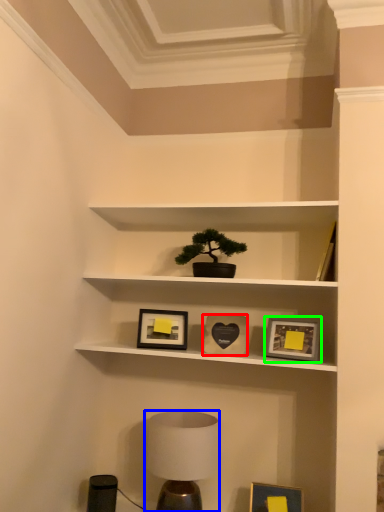
Question: Estimate the real-world distances between objects in this image. Which object is farther from picture frame (highlighted by a red box), table lamp (highlighted by a blue box) or picture frame (highlighted by a green box)?

Choices:
 (A) table lamp
 (B) picture frame

Answer: (A)